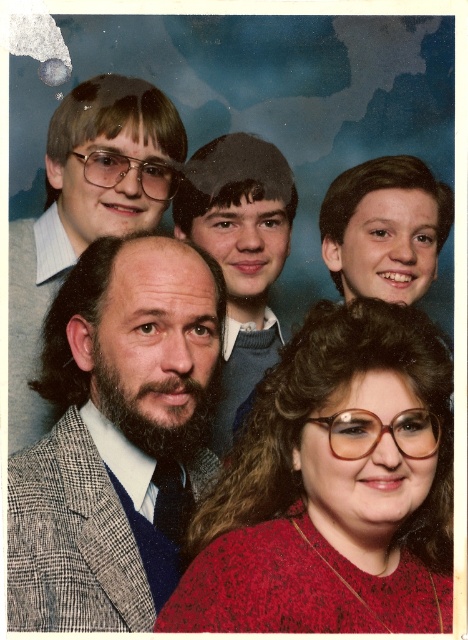
Does knitted red sweater at center have a greater height compared to gray checkered suit at center?

In fact, knitted red sweater at center may be shorter than gray checkered suit at center.

Is knitted red sweater at center thinner than gray checkered suit at center?

In fact, knitted red sweater at center might be wider than gray checkered suit at center.

Locate an element on the screen. The image size is (468, 640). knitted red sweater at center is located at coordinates (333, 488).

I want to click on knitted red sweater at center, so click(333, 488).

Between knitted red sweater at center and smooth gray sweater at center, which one has more height?

With more height is smooth gray sweater at center.

Is point (401, 436) positioned before point (257, 316)?

Yes.

The image size is (468, 640). Identify the location of knitted red sweater at center. (333, 488).

In the scene shown: Can you confirm if gray checkered suit at center is taller than smooth gray sweater at center?

No.

Which is more to the right, gray checkered suit at center or smooth gray sweater at center?

Positioned to the right is smooth gray sweater at center.

Does point (155, 486) lie in front of point (187, 170)?

Yes, it is.

What are the coordinates of `gray checkered suit at center` in the screenshot? It's located at (110, 428).